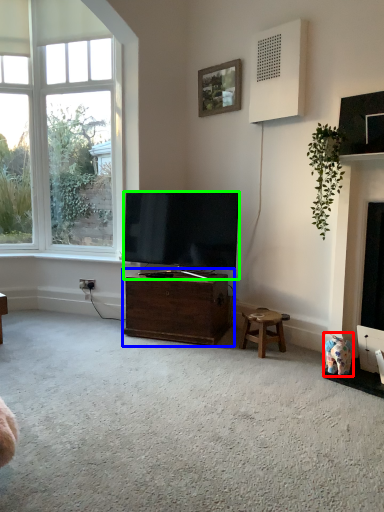
Question: Estimate the real-world distances between objects in this image. Which object is closer to toy (highlighted by a red box), cabinetry (highlighted by a blue box) or television (highlighted by a green box)?

Choices:
 (A) cabinetry
 (B) television

Answer: (A)